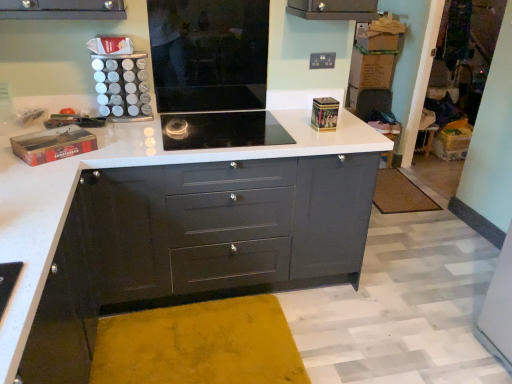
Question: Could you tell me if black glass cooktop at center is turned towards brown textured mat at lower right?

Choices:
 (A) no
 (B) yes

Answer: (A)

Question: From the image's perspective, is black glass cooktop at center above brown textured mat at lower right?

Choices:
 (A) yes
 (B) no

Answer: (A)

Question: Can we say black glass cooktop at center lies outside brown textured mat at lower right?

Choices:
 (A) no
 (B) yes

Answer: (B)

Question: Does black glass cooktop at center appear on the left side of brown textured mat at lower right?

Choices:
 (A) no
 (B) yes

Answer: (B)

Question: Is black glass cooktop at center bigger than brown textured mat at lower right?

Choices:
 (A) yes
 (B) no

Answer: (A)

Question: Is point (186, 26) positioned closer to the camera than point (431, 205)?

Choices:
 (A) farther
 (B) closer

Answer: (B)

Question: Considering the positions of black glass cooktop at center and brown textured mat at lower right in the image, is black glass cooktop at center taller or shorter than brown textured mat at lower right?

Choices:
 (A) tall
 (B) short

Answer: (A)

Question: From a real-world perspective, is black glass cooktop at center physically located above or below brown textured mat at lower right?

Choices:
 (A) below
 (B) above

Answer: (B)

Question: Relative to brown textured mat at lower right, is black glass cooktop at center in front or behind?

Choices:
 (A) front
 (B) behind

Answer: (A)

Question: Looking at their shapes, would you say black glass cooktop at center is wider or thinner than matte black chest of drawers at center?

Choices:
 (A) thin
 (B) wide

Answer: (A)

Question: From their relative heights in the image, would you say black glass cooktop at center is taller or shorter than matte black chest of drawers at center?

Choices:
 (A) short
 (B) tall

Answer: (A)

Question: Is black glass cooktop at center in front of or behind matte black chest of drawers at center in the image?

Choices:
 (A) behind
 (B) front

Answer: (A)

Question: From a real-world perspective, relative to matte black chest of drawers at center, is black glass cooktop at center vertically above or below?

Choices:
 (A) below
 (B) above

Answer: (B)

Question: Is black glass cooktop at center in front of or behind black glass cooktop at center in the image?

Choices:
 (A) behind
 (B) front

Answer: (A)

Question: Is black glass cooktop at center spatially inside black glass cooktop at center, or outside of it?

Choices:
 (A) inside
 (B) outside

Answer: (B)